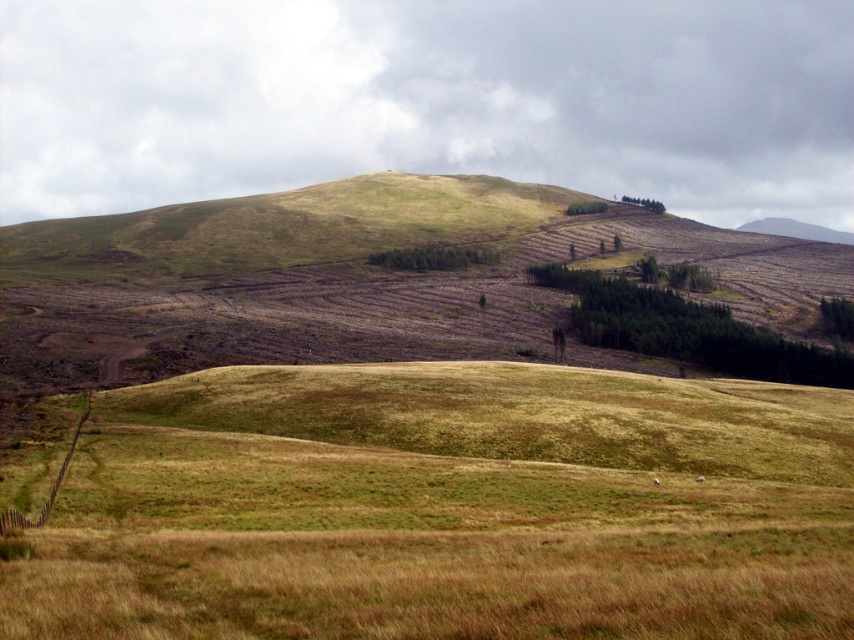
You are standing at the starting point of the dirt path in the grassy field. You see two points marked on your map, point 1 at coordinates point (x=636, y=340) and point 2 at coordinates point (x=601, y=211). Which point is closer to you as you walk along the path?

Point (x=636, y=340) is in front of point (x=601, y=211), so as you walk along the path, point (x=636, y=340) will be closer to you first before reaching point (x=601, y=211).

You are standing at the starting point of the dirt path in the grassy field. You see two points marked in the image. Which point is closer to you, point (711, 307) or point (385, 259)?

Point (711, 307) is closer to the viewer than point (385, 259).

You are a hiker trying to navigate through the cleared areas in the midground. You see the green textured trees at center and the green coniferous trees at center. Which type of tree has a wider spread when viewed from above?

The green textured trees at center have a wider spread when viewed from above compared to the green coniferous trees at center, as their width surpasses the latter.